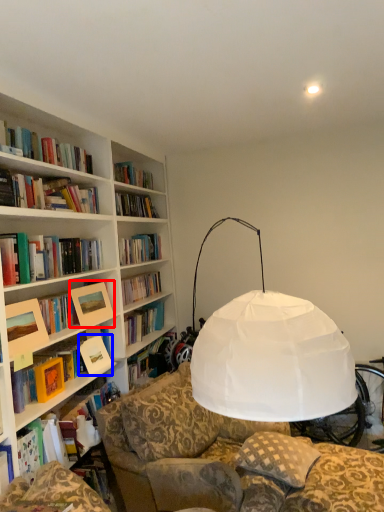
Question: Which of the following is the farthest to the observer, picture frame (highlighted by a red box) or paperback book (highlighted by a blue box)?

Choices:
 (A) picture frame
 (B) paperback book

Answer: (B)